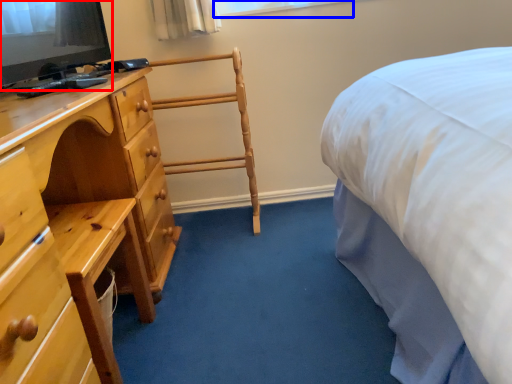
Question: Which point is closer to the camera, television (highlighted by a red box) or window (highlighted by a blue box)?

Choices:
 (A) television
 (B) window

Answer: (A)